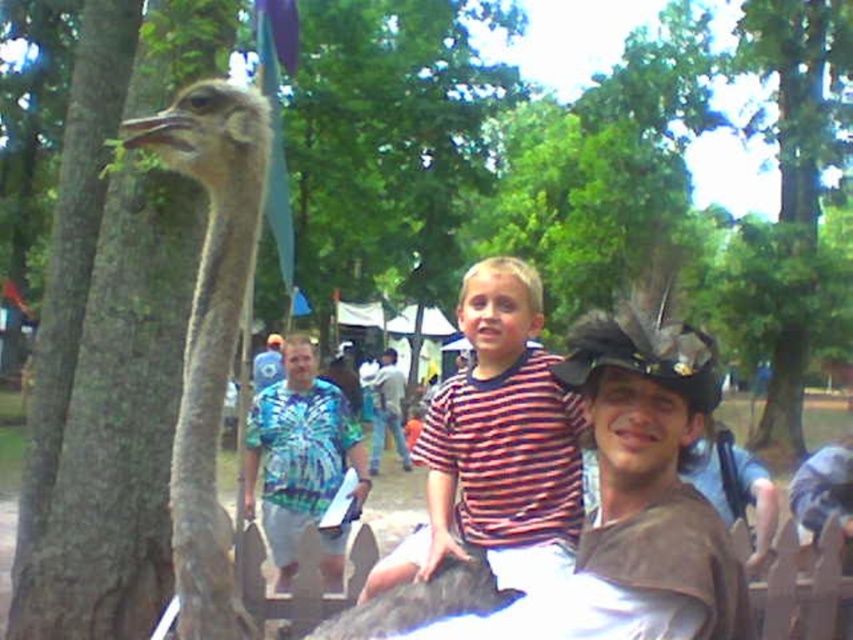
Question: Which of the following is the closest to the observer?

Choices:
 (A) tie-dye fabric shirt at center
 (B) blue tie-dye shirt at center
 (C) striped fabric shirt at center

Answer: (C)

Question: Is brown feathered ostrich at left below blue tie-dye shirt at center?

Choices:
 (A) no
 (B) yes

Answer: (A)

Question: Among these points, which one is nearest to the camera?

Choices:
 (A) (509, 376)
 (B) (231, 241)
 (C) (265, 449)
 (D) (386, 404)

Answer: (B)

Question: Does tie-dye fabric shirt at center appear over blue tie-dye shirt at center?

Choices:
 (A) no
 (B) yes

Answer: (B)

Question: Can you confirm if striped fabric shirt at center is thinner than blue tie-dye shirt at center?

Choices:
 (A) no
 (B) yes

Answer: (B)

Question: Which object appears closest to the camera in this image?

Choices:
 (A) blue tie-dye shirt at center
 (B) brown feathered ostrich at left
 (C) tie-dye fabric shirt at center
 (D) striped fabric shirt at center

Answer: (B)